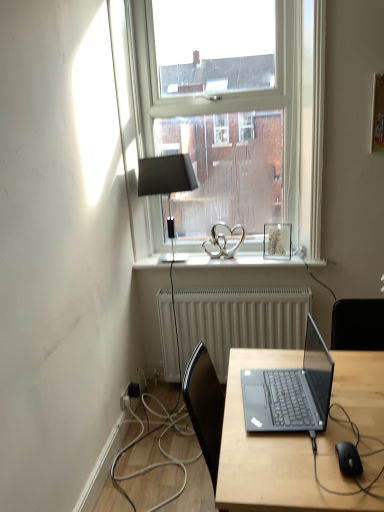
You are a GUI agent. You are given a task and a screenshot of the screen. Output one action in this format:
    pyautogui.click(x=<x>, y=<y>)
    Task: Click on the vacant space situated on the left part of black matte computer mouse at lower right
    The width and height of the screenshot is (384, 512).
    Given the screenshot: What is the action you would take?
    pyautogui.click(x=296, y=465)